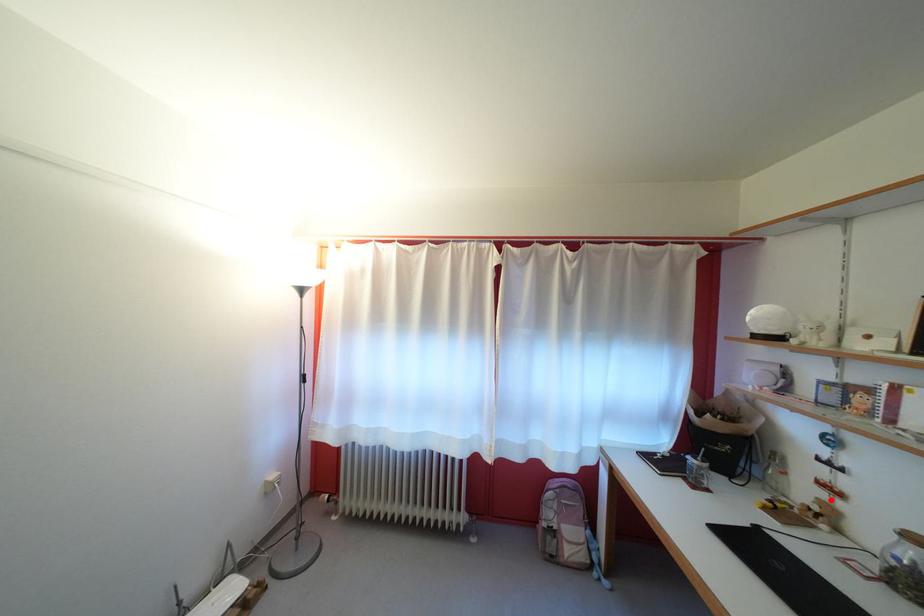
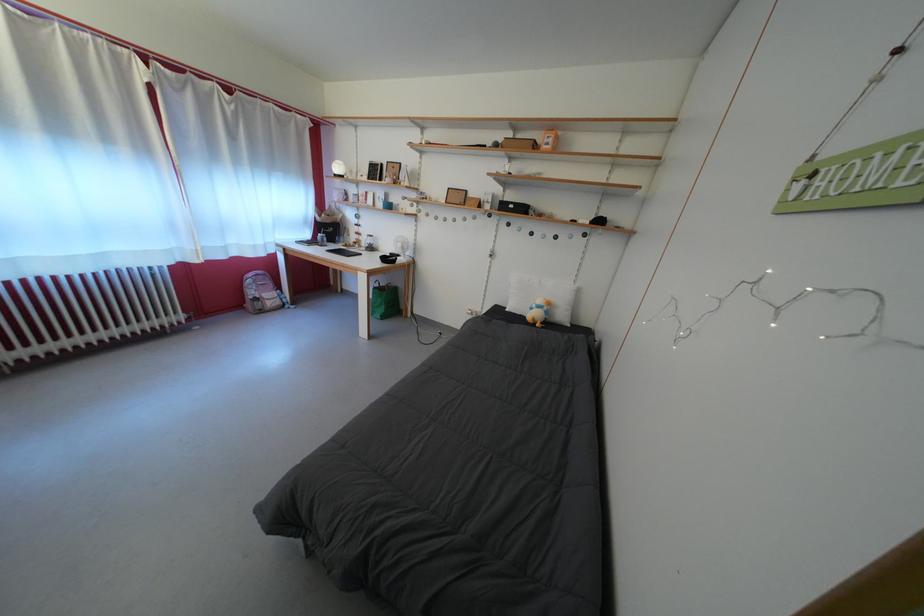
Question: I am providing you with two images of the same scene from different viewpoints. Given a red point in image1, look at the same physical point in image2. Is it:

Choices:
 (A) Closer to the viewpoint
 (B) Farther from the viewpoint

Answer: (A)